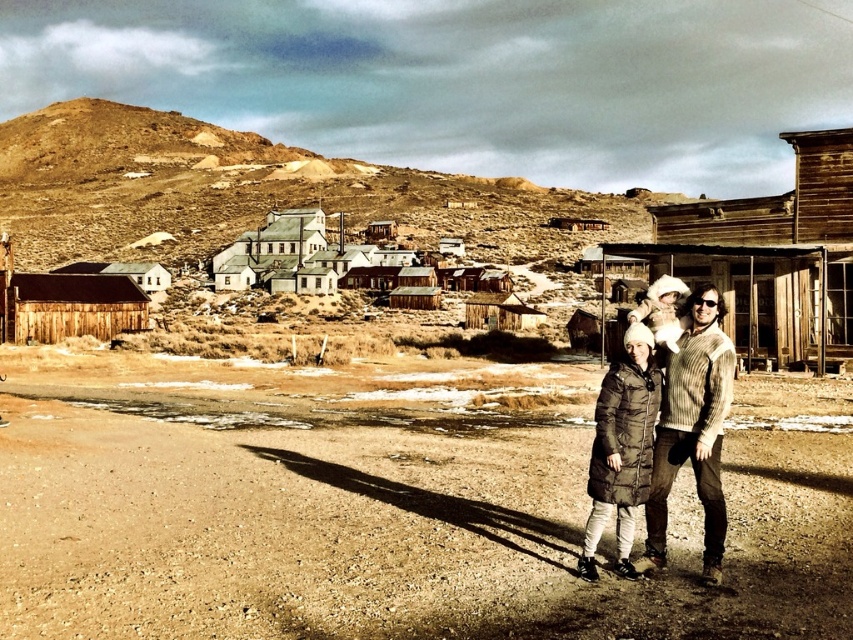
You are a photographer planning to take a group photo of the three people in the scene. You want to ensure that both the brown dirt field at lower center and the green quilted coat at center are in focus. Given that your camera has a depth of field that can cover 10 meters, will both objects be in focus?

The brown dirt field at lower center is 10.54 meters away from the green quilted coat at center. Since the distance between them exceeds the camera depth of field of 10 meters, the two objects might not both be in focus simultaneously.